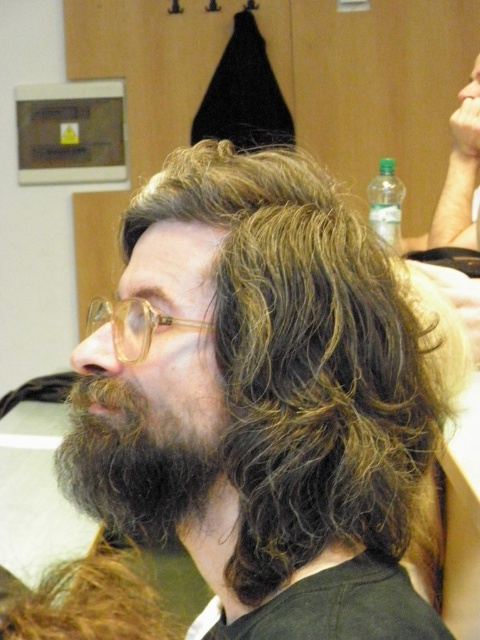
Question: Is the position of translucent plastic glasses at left less distant than that of clear plastic bottle at upper right?

Choices:
 (A) no
 (B) yes

Answer: (B)

Question: Which object is positioned farthest from the dark brown fuzzy beard at lower left?

Choices:
 (A) clear plastic bottle at upper right
 (B) translucent plastic glasses at left
 (C) dark brown wavy hair at center

Answer: (A)

Question: Is dark brown wavy hair at center closer to camera compared to translucent plastic glasses at left?

Choices:
 (A) no
 (B) yes

Answer: (B)

Question: Estimate the real-world distances between objects in this image. Which object is farther from the dark brown wavy hair at center?

Choices:
 (A) translucent plastic glasses at left
 (B) clear plastic bottle at upper right

Answer: (B)

Question: Does dark brown fuzzy beard at lower left have a lesser width compared to translucent plastic glasses at left?

Choices:
 (A) no
 (B) yes

Answer: (B)

Question: Which is nearer to the dark brown fuzzy beard at lower left?

Choices:
 (A) dark brown wavy hair at center
 (B) clear plastic bottle at upper right

Answer: (A)